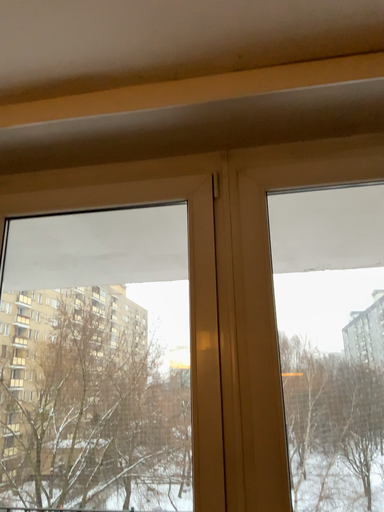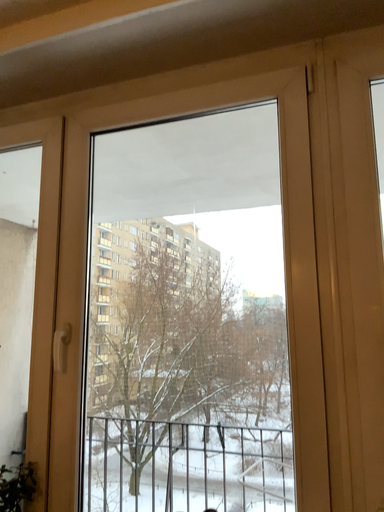
Question: How did the camera likely rotate when shooting the video?

Choices:
 (A) rotated right
 (B) rotated left

Answer: (B)